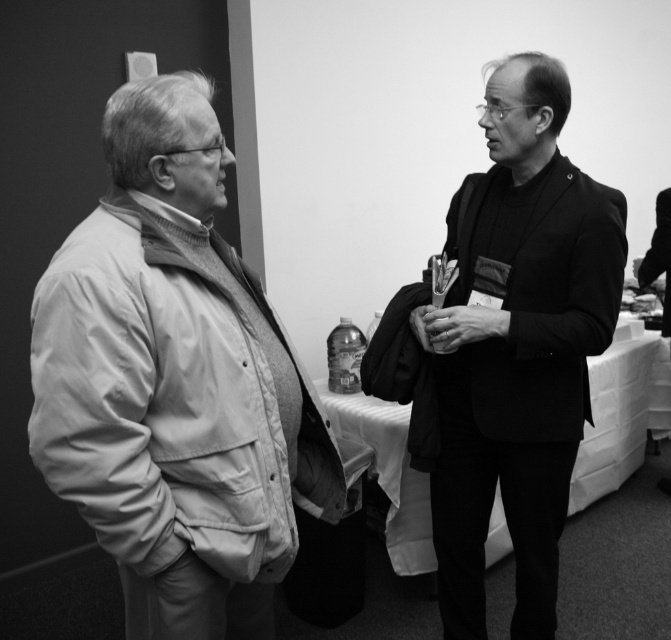
Between matte beige jacket at left and smooth black jacket at right, which one has more height?

matte beige jacket at left

Can you confirm if matte beige jacket at left is thinner than smooth black jacket at right?

No.

The width and height of the screenshot is (671, 640). What do you see at coordinates (174, 384) in the screenshot? I see `matte beige jacket at left` at bounding box center [174, 384].

Locate an element on the screen. This screenshot has height=640, width=671. matte beige jacket at left is located at coordinates (174, 384).

Find the location of a particular element. matte beige jacket at left is located at coordinates (174, 384).

From the picture: Measure the distance between matte beige jacket at left and smooth black suit at center.

They are 25.50 inches apart.

Does point (231, 429) come closer to viewer compared to point (454, 516)?

Yes, point (231, 429) is in front of point (454, 516).

The width and height of the screenshot is (671, 640). In order to click on matte beige jacket at left in this screenshot , I will do `click(174, 384)`.

Who is taller, smooth black suit at center or smooth black jacket at right?

smooth black suit at center

Locate an element on the screen. smooth black suit at center is located at coordinates (517, 348).

The height and width of the screenshot is (640, 671). Identify the location of smooth black suit at center. (517, 348).